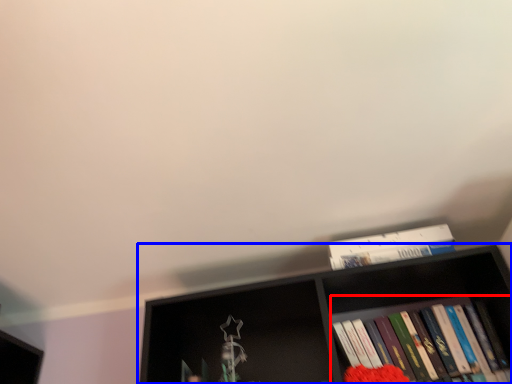
Question: Which point is further to the camera, book (highlighted by a red box) or shelf (highlighted by a blue box)?

Choices:
 (A) book
 (B) shelf

Answer: (A)